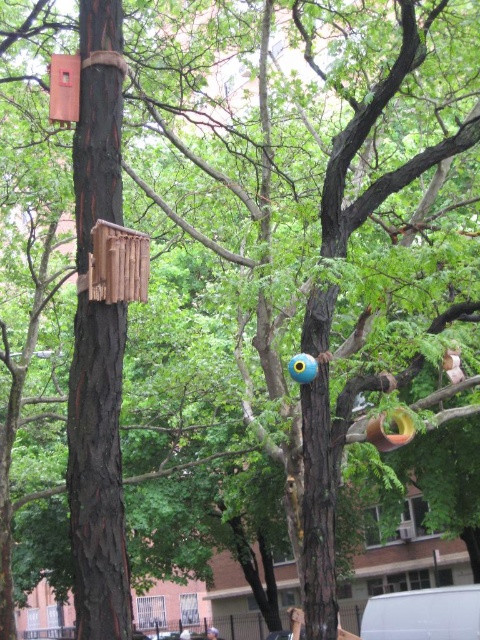
Does wooden bird feeder at left have a smaller size compared to blue plastic ball at center?

Correct, wooden bird feeder at left occupies less space than blue plastic ball at center.

Is point (121, 236) less distant than point (215, 630)?

That is True.

Between point (147, 244) and point (218, 634), which one is positioned behind?

The point (218, 634) is more distant.

In order to click on wooden bird feeder at left in this screenshot , I will do `click(117, 264)`.

Which is below, wooden bird feeder at left or blue matte birdhouse at center?

blue matte birdhouse at center is below.

The width and height of the screenshot is (480, 640). What do you see at coordinates (117, 264) in the screenshot?
I see `wooden bird feeder at left` at bounding box center [117, 264].

Identify the location of wooden bird feeder at left. (117, 264).

Is blue matte birdhouse at center to the left of blue plastic ball at center from the viewer's perspective?

No, blue matte birdhouse at center is not to the left of blue plastic ball at center.

Can you confirm if blue matte birdhouse at center is thinner than blue plastic ball at center?

Indeed, blue matte birdhouse at center has a lesser width compared to blue plastic ball at center.

This screenshot has width=480, height=640. In order to click on blue matte birdhouse at center in this screenshot , I will do `click(302, 368)`.

The height and width of the screenshot is (640, 480). In order to click on blue matte birdhouse at center in this screenshot , I will do `click(302, 368)`.